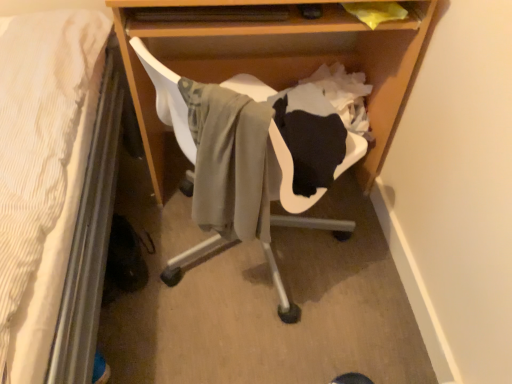
Question: Is wooden desk at center in contact with white plastic swivel chair at center?

Choices:
 (A) yes
 (B) no

Answer: (B)

Question: Can you confirm if wooden desk at center is positioned to the right of white plastic swivel chair at center?

Choices:
 (A) yes
 (B) no

Answer: (A)

Question: Is wooden desk at center not within white plastic swivel chair at center?

Choices:
 (A) no
 (B) yes

Answer: (B)

Question: From the image's perspective, is wooden desk at center on top of white plastic swivel chair at center?

Choices:
 (A) no
 (B) yes

Answer: (B)

Question: Can you confirm if wooden desk at center is taller than white plastic swivel chair at center?

Choices:
 (A) no
 (B) yes

Answer: (B)

Question: Does wooden desk at center lie in front of white plastic swivel chair at center?

Choices:
 (A) yes
 (B) no

Answer: (B)

Question: Is white plastic swivel chair at center bigger than wooden desk at center?

Choices:
 (A) yes
 (B) no

Answer: (B)

Question: From the image's perspective, does white plastic swivel chair at center appear lower than wooden desk at center?

Choices:
 (A) no
 (B) yes

Answer: (B)

Question: From a real-world perspective, is white plastic swivel chair at center below wooden desk at center?

Choices:
 (A) no
 (B) yes

Answer: (A)

Question: Is white plastic swivel chair at center closer to camera compared to wooden desk at center?

Choices:
 (A) no
 (B) yes

Answer: (B)

Question: Can you confirm if white plastic swivel chair at center is smaller than wooden desk at center?

Choices:
 (A) yes
 (B) no

Answer: (A)

Question: Is white plastic swivel chair at center not inside wooden desk at center?

Choices:
 (A) yes
 (B) no

Answer: (A)

Question: Looking at the image, does wooden desk at center seem bigger or smaller compared to white plastic swivel chair at center?

Choices:
 (A) big
 (B) small

Answer: (A)